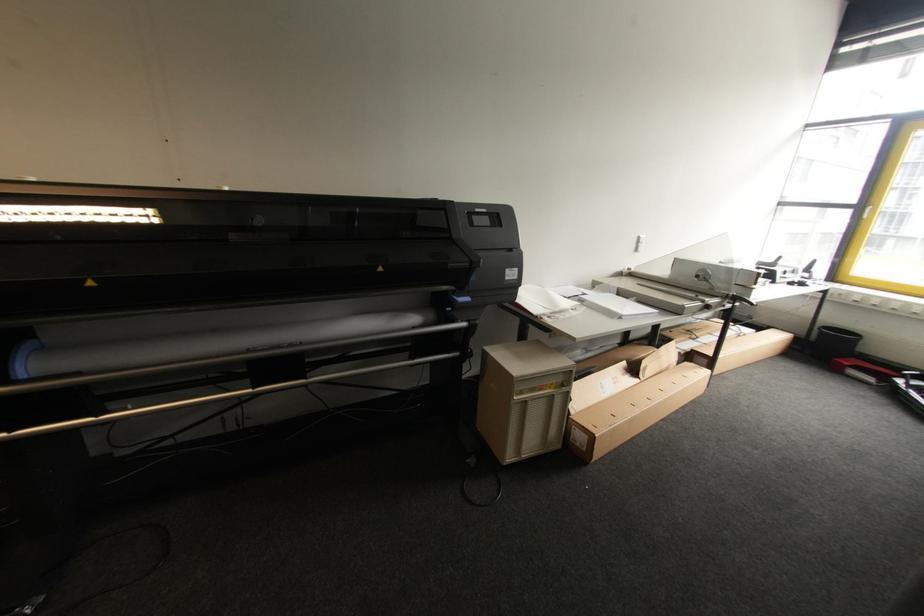
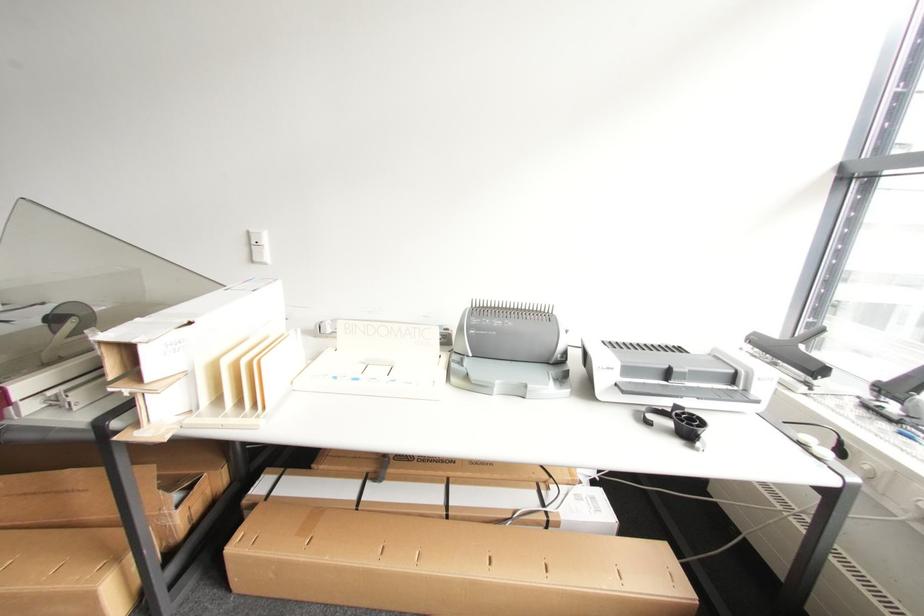
In a continuous first-person perspective shot, in which direction is the camera moving?

The movement direction of the cameraman is right, forward.